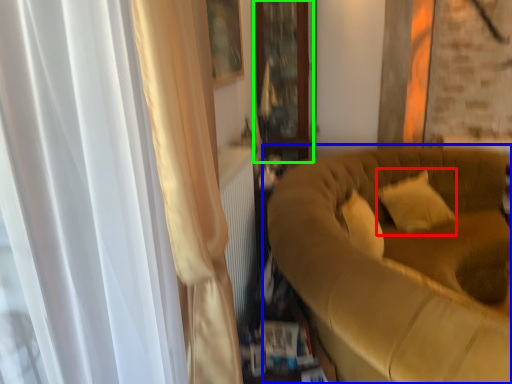
Question: Considering the real-world distances, which object is closest to pillow (highlighted by a red box)? studio couch (highlighted by a blue box) or glass door (highlighted by a green box).

Choices:
 (A) studio couch
 (B) glass door

Answer: (A)